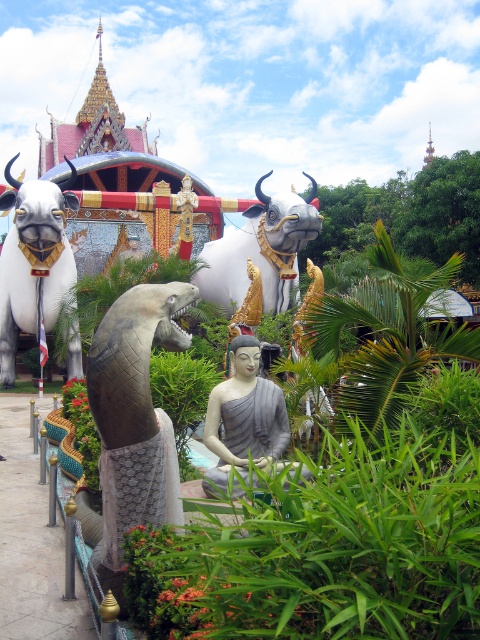
Between white glossy bull at upper left and white glossy statue at center, which one has more height?

Standing taller between the two is white glossy bull at upper left.

Is point (36, 276) behind point (280, 202)?

No, it is not.

Locate an element on the screen. The image size is (480, 640). white glossy bull at upper left is located at coordinates (33, 260).

Is point (153, 458) closer to viewer compared to point (248, 417)?

Yes, it is in front of point (248, 417).

Can you confirm if shiny metallic snake at center is positioned above gray stone statue at center?

Yes.

Is point (110, 394) closer to viewer compared to point (219, 483)?

Yes, it is in front of point (219, 483).

Find the location of a particular element. shiny metallic snake at center is located at coordinates (134, 413).

Which is more to the right, white glossy statue at center or gray stone statue at center?

white glossy statue at center

Is the position of white glossy statue at center more distant than that of gray stone statue at center?

Yes, it is behind gray stone statue at center.

Between point (271, 296) and point (274, 456), which one is positioned behind?

The point (271, 296) is behind.

Locate an element on the screen. white glossy statue at center is located at coordinates (x=261, y=250).